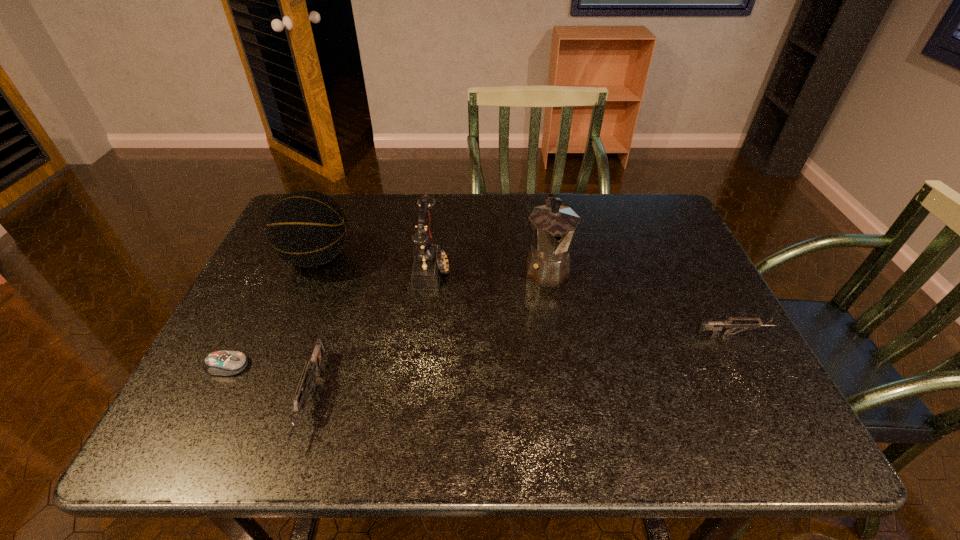
The image size is (960, 540). I want to click on vacant area between the computer mouse and the basketball, so click(273, 312).

Where is `free space between the taller gun and the rightmost object`? This screenshot has height=540, width=960. free space between the taller gun and the rightmost object is located at coordinates (523, 366).

Locate an element on the screen. Image resolution: width=960 pixels, height=540 pixels. blank region between the computer mouse and the rightmost object is located at coordinates (481, 350).

You are a GUI agent. You are given a task and a screenshot of the screen. Output one action in this format:
    pyautogui.click(x=<x>, y=<y>)
    Task: Click on the free space that is in between the third object from right to left and the basketball
    
    Given the screenshot: What is the action you would take?
    pyautogui.click(x=374, y=263)

You are a GUI agent. You are given a task and a screenshot of the screen. Output one action in this format:
    pyautogui.click(x=<x>, y=<y>)
    Task: Click on the vacant space in between the third nearest object and the second object from right to left
    
    Given the screenshot: What is the action you would take?
    pyautogui.click(x=640, y=301)

Identify which object is the fifth closest to the fifth object from left to right. Please provide its 2D coordinates. Your answer should be formatted as a tuple, i.e. [(x, y)], where the tuple contains the x and y coordinates of a point satisfying the conditions above.

[(221, 363)]

Locate which object is the third closest to the coffeepot. Please provide its 2D coordinates. Your answer should be formatted as a tuple, i.e. [(x, y)], where the tuple contains the x and y coordinates of a point satisfying the conditions above.

[(305, 228)]

The image size is (960, 540). I want to click on vacant area in the image that satisfies the following two spatial constraints: 1. on the dial of the third object from right to left; 2. aimed along the barrel of the left gun, so click(417, 397).

The width and height of the screenshot is (960, 540). I want to click on blank area in the image that satisfies the following two spatial constraints: 1. on the front side of the basketball; 2. on the wheel side of the shortest object, so click(x=273, y=366).

Identify the location of free space that satisfies the following two spatial constraints: 1. on the pouring side of the second object from right to left; 2. on the wheel side of the computer mouse. (563, 366).